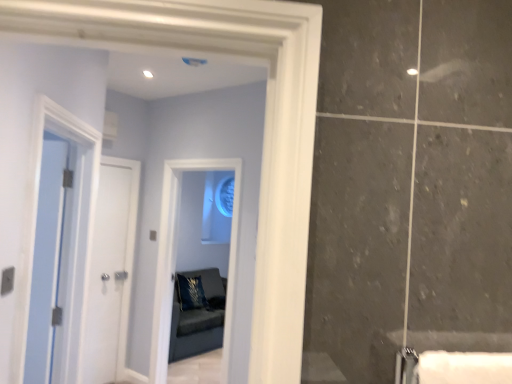
Question: Can you confirm if blue velvet pillow at center is smaller than white glossy door at left, the 2th door in the front-to-back sequence?

Choices:
 (A) yes
 (B) no

Answer: (B)

Question: Is blue velvet pillow at center beside white glossy door at left, which is counted as the first door, starting from the back?

Choices:
 (A) yes
 (B) no

Answer: (B)

Question: Is blue velvet pillow at center not near white glossy door at left, which is counted as the first door, starting from the back?

Choices:
 (A) yes
 (B) no

Answer: (A)

Question: Can you confirm if blue velvet pillow at center is shorter than white glossy door at left, the 2th door in the front-to-back sequence?

Choices:
 (A) yes
 (B) no

Answer: (A)

Question: Does blue velvet pillow at center appear on the right side of white glossy door at left, which is counted as the first door, starting from the back?

Choices:
 (A) yes
 (B) no

Answer: (A)

Question: From the image's perspective, is blue glass window at center above or below white glossy door at left, which is counted as the first door, starting from the back?

Choices:
 (A) above
 (B) below

Answer: (A)

Question: Based on their sizes in the image, would you say blue glass window at center is bigger or smaller than white glossy door at left, which is counted as the first door, starting from the back?

Choices:
 (A) small
 (B) big

Answer: (B)

Question: In terms of height, does blue glass window at center look taller or shorter compared to white glossy door at left, which is counted as the first door, starting from the back?

Choices:
 (A) tall
 (B) short

Answer: (A)

Question: Would you say blue glass window at center is to the left or to the right of white glossy door at left, which is counted as the first door, starting from the back, in the picture?

Choices:
 (A) right
 (B) left

Answer: (A)

Question: Choose the correct answer: Is clear glass mirror at center inside white glossy door at left, which is counted as the first door, starting from the back, or outside it?

Choices:
 (A) inside
 (B) outside

Answer: (B)

Question: From the image's perspective, is clear glass mirror at center located above or below white glossy door at left, the 2th door in the front-to-back sequence?

Choices:
 (A) below
 (B) above

Answer: (B)

Question: Is clear glass mirror at center bigger or smaller than white glossy door at left, which is counted as the first door, starting from the back?

Choices:
 (A) big
 (B) small

Answer: (A)

Question: Is clear glass mirror at center taller or shorter than white glossy door at left, the 2th door in the front-to-back sequence?

Choices:
 (A) short
 (B) tall

Answer: (A)

Question: In terms of height, does clear glass mirror at center look taller or shorter compared to blue glass window at center?

Choices:
 (A) short
 (B) tall

Answer: (A)

Question: From the image's perspective, is clear glass mirror at center located above or below blue glass window at center?

Choices:
 (A) above
 (B) below

Answer: (A)